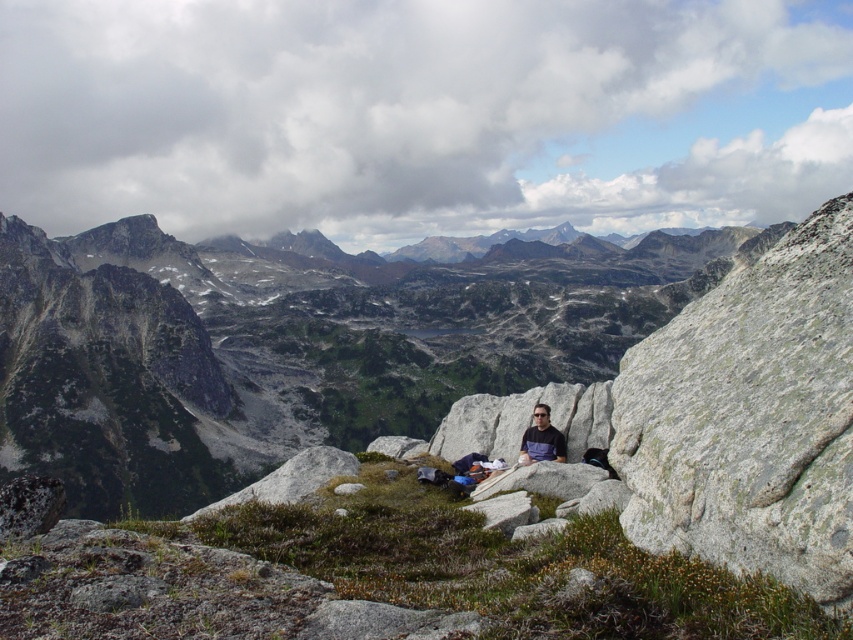
Does gray rock at center appear on the left side of matte gray shirt at center?

No, gray rock at center is not to the left of matte gray shirt at center.

The width and height of the screenshot is (853, 640). Find the location of `gray rock at center`. gray rock at center is located at coordinates (466, 378).